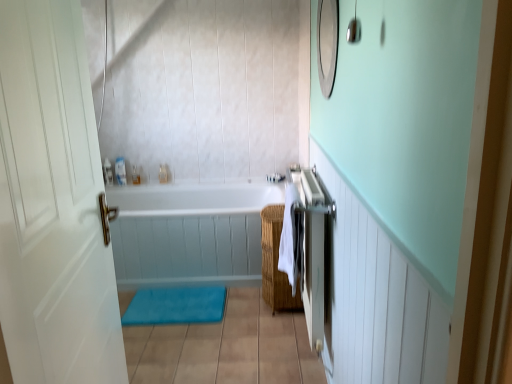
Find the location of a particular element. The width and height of the screenshot is (512, 384). spots to the right of blue fabric bath mat at lower center is located at coordinates (245, 311).